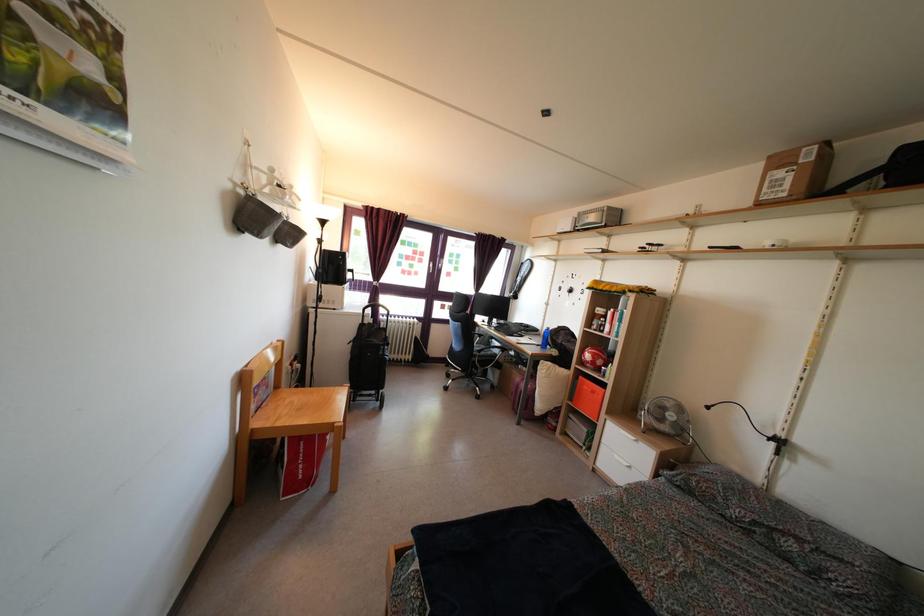
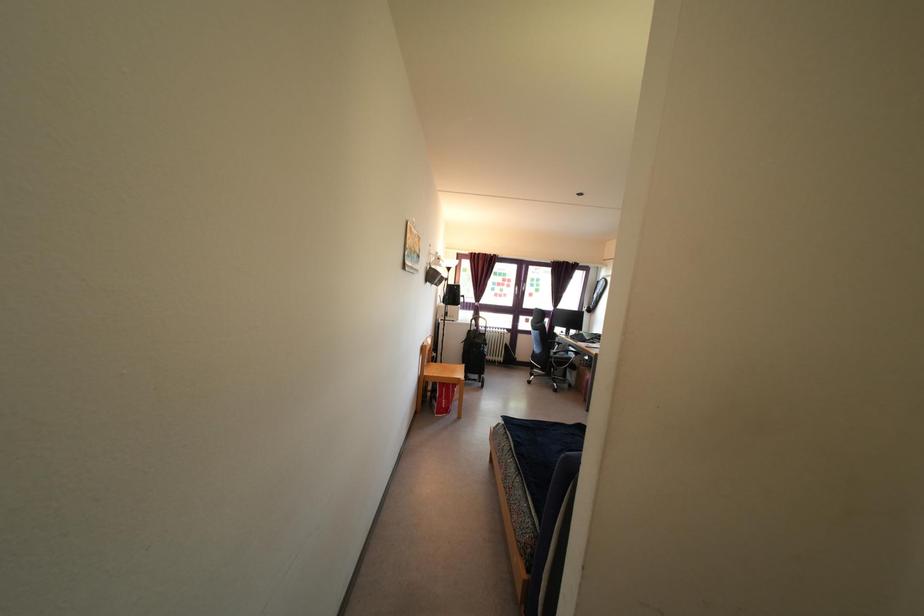
The point at (489,328) is marked in the first image. Where is the corresponding point in the second image?

(566, 338)